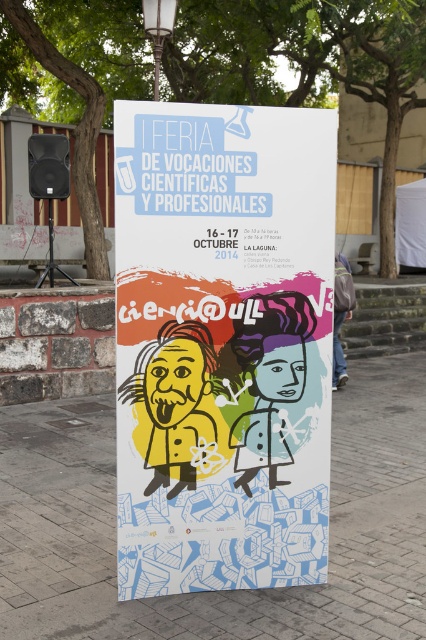
You are a pedestrian walking past the poster and notice the brick pavement at center and the denim jacket at lower right. Which object appears larger in the image?

The denim jacket at lower right appears larger than the brick pavement at center.

From the picture: What is located at the coordinates point (215, 589) in the image?

At point (215, 589) lies brick pavement at center.